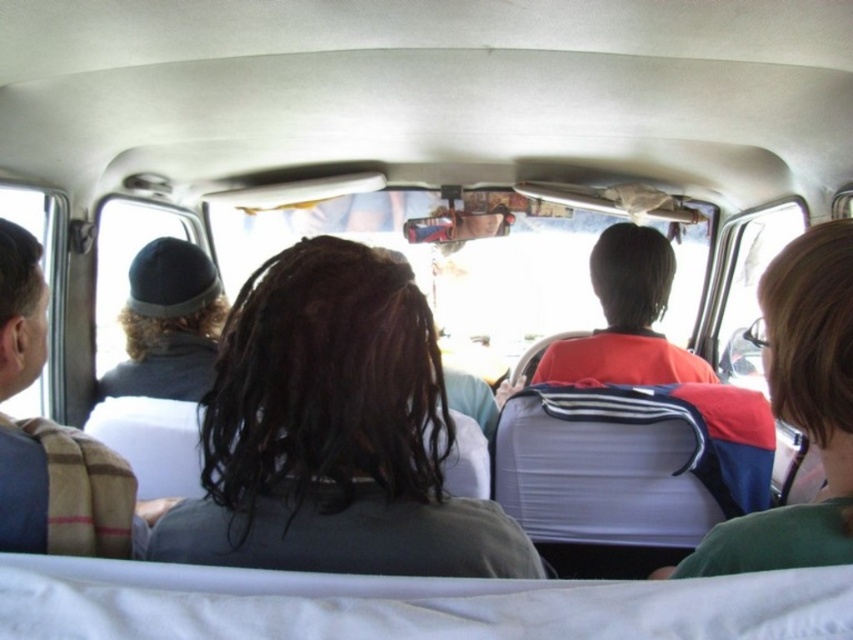
Can you confirm if dark brown hair at center is positioned to the left of red and blue backpack at center?

Indeed, dark brown hair at center is positioned on the left side of red and blue backpack at center.

Which is more to the left, dark brown hair at center or red and blue backpack at center?

From the viewer's perspective, dark brown hair at center appears more on the left side.

Who is more distant from viewer, (432, 419) or (784, 316)?

The point (432, 419) is behind.

Identify the location of dark brown hair at center. The width and height of the screenshot is (853, 640). (334, 433).

Is point (749, 532) behind point (175, 333)?

No.

Between point (764, 371) and point (122, 371), which one is positioned in front?

Point (764, 371)

Is point (804, 410) positioned in front of point (117, 364)?

Yes.

Find the location of `red and blue backpack at center`. red and blue backpack at center is located at coordinates (799, 410).

Is red matte shirt at center shorter than dark gray knit cap at left?

Correct, red matte shirt at center is not as tall as dark gray knit cap at left.

Can you confirm if red matte shirt at center is positioned below dark gray knit cap at left?

No.

The width and height of the screenshot is (853, 640). I want to click on red matte shirt at center, so click(x=625, y=317).